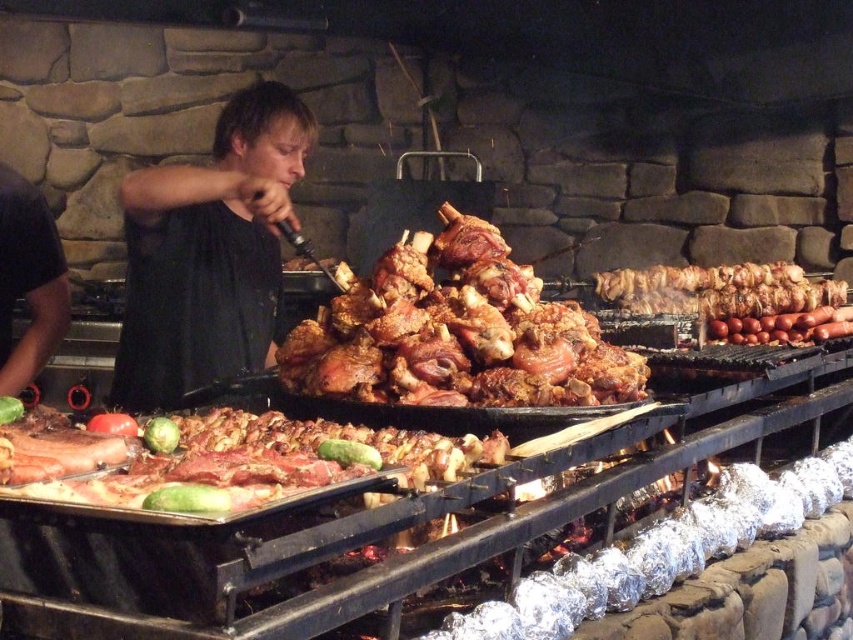
Which of these two, raw meat at center or golden brown meat skewers at right, stands taller?

Standing taller between the two is golden brown meat skewers at right.

Who is lower down, raw meat at center or golden brown meat skewers at right?

raw meat at center is below.

Does point (178, 465) come closer to viewer compared to point (657, 292)?

Yes.

The height and width of the screenshot is (640, 853). I want to click on raw meat at center, so click(x=224, y=461).

Who is lower down, black matte shirt at center or raw meat at center?

raw meat at center is below.

Does black matte shirt at center appear under raw meat at center?

Incorrect, black matte shirt at center is not positioned below raw meat at center.

Is point (234, 339) positioned before point (412, 472)?

No, (234, 339) is behind (412, 472).

The height and width of the screenshot is (640, 853). Find the location of `black matte shirt at center`. black matte shirt at center is located at coordinates (209, 252).

Who is positioned more to the right, black matte shirt at center or golden brown meat skewers at right?

golden brown meat skewers at right

In the scene shown: Who is taller, black matte shirt at center or golden brown meat skewers at right?

black matte shirt at center

Is point (215, 280) positioned behind point (798, 275)?

No.

Locate an element on the screen. The height and width of the screenshot is (640, 853). black matte shirt at center is located at coordinates (209, 252).